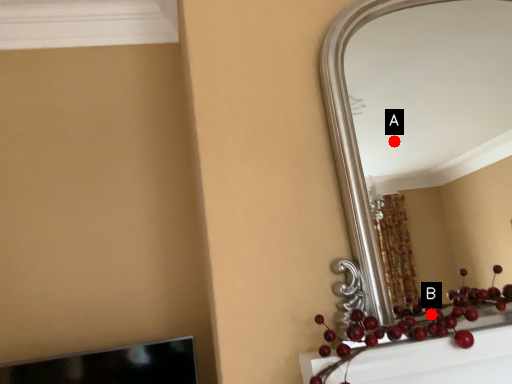
Question: Two points are circled on the image, labeled by A and B beside each circle. Which point appears farthest from the camera in this image?

Choices:
 (A) A is further
 (B) B is further

Answer: (A)